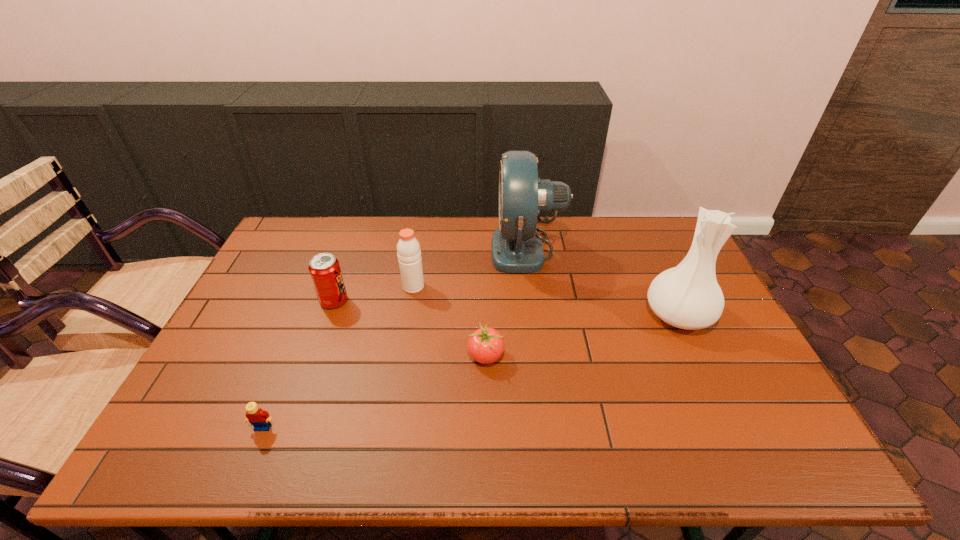
Locate an element on the screen. This screenshot has height=540, width=960. fan is located at coordinates (516, 247).

The width and height of the screenshot is (960, 540). What are the coordinates of `the rightmost object` in the screenshot? It's located at (687, 296).

Locate an element on the screen. The height and width of the screenshot is (540, 960). shaker is located at coordinates (408, 248).

Locate an element on the screen. This screenshot has width=960, height=540. the third tallest object is located at coordinates (408, 248).

The width and height of the screenshot is (960, 540). In order to click on the fourth tallest object in this screenshot , I will do `click(324, 268)`.

The image size is (960, 540). What are the coordinates of `the second nearest object` in the screenshot? It's located at (485, 345).

The width and height of the screenshot is (960, 540). I want to click on the nearest object, so click(x=259, y=418).

The height and width of the screenshot is (540, 960). I want to click on vacant space located 0.180m in front of the fan to blow air, so click(x=439, y=248).

The width and height of the screenshot is (960, 540). I want to click on blank space located 0.090m in front of the fan to blow air, so click(x=466, y=248).

Where is `vacant region located in front of the fan to blow air`? The width and height of the screenshot is (960, 540). vacant region located in front of the fan to blow air is located at coordinates (433, 248).